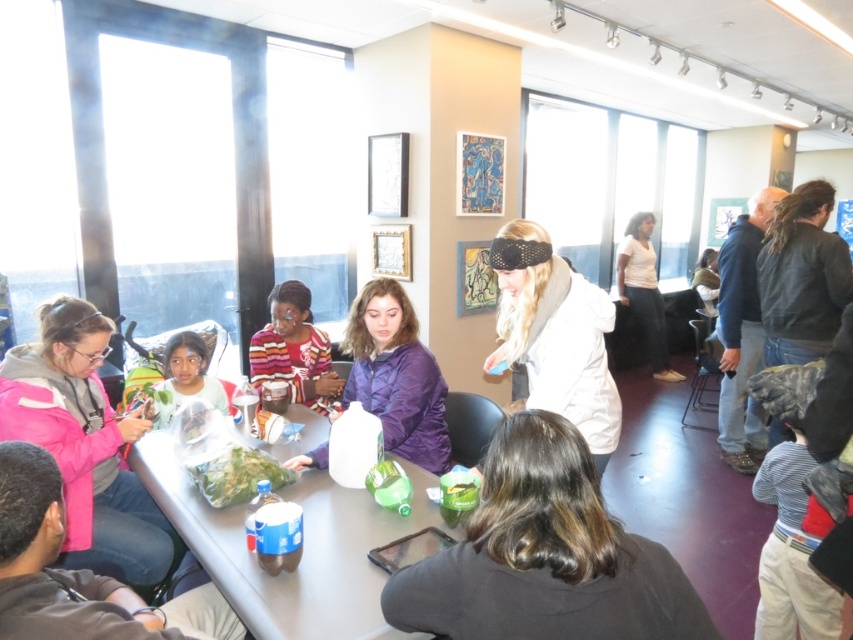
Question: Is white matte jacket at center thinner than white cotton shirt at upper right?

Choices:
 (A) no
 (B) yes

Answer: (B)

Question: Which of the following is the closest to the observer?

Choices:
 (A) striped sweater at center
 (B) translucent plastic bag at lower left
 (C) clear plastic table at center
 (D) white matte jacket at center

Answer: (D)

Question: Can you confirm if white matte jacket at center is thinner than white cotton shirt at upper right?

Choices:
 (A) no
 (B) yes

Answer: (B)

Question: Which object is closer to the camera taking this photo?

Choices:
 (A) clear plastic table at center
 (B) white matte jacket at center
 (C) translucent plastic bag at lower left

Answer: (B)

Question: Can you confirm if striped sweater at center is thinner than green plastic bag at center?

Choices:
 (A) no
 (B) yes

Answer: (A)

Question: Considering the real-world distances, which object is farthest from the striped sweater at center?

Choices:
 (A) green plastic bag at center
 (B) white matte jacket at center
 (C) translucent plastic bag at lower left

Answer: (B)